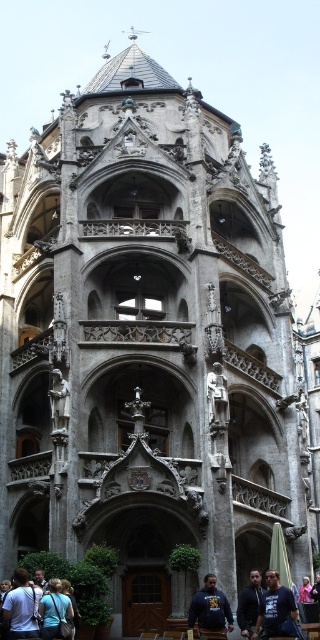
You are standing in front of the grand Gothic building and notice a denim jacket at lower left. Based on its 2D location coordinates, where exactly is the denim jacket positioned relative to the building?

The denim jacket at lower left is positioned at coordinates point (22, 605), which places it near the bottom right corner of the building.